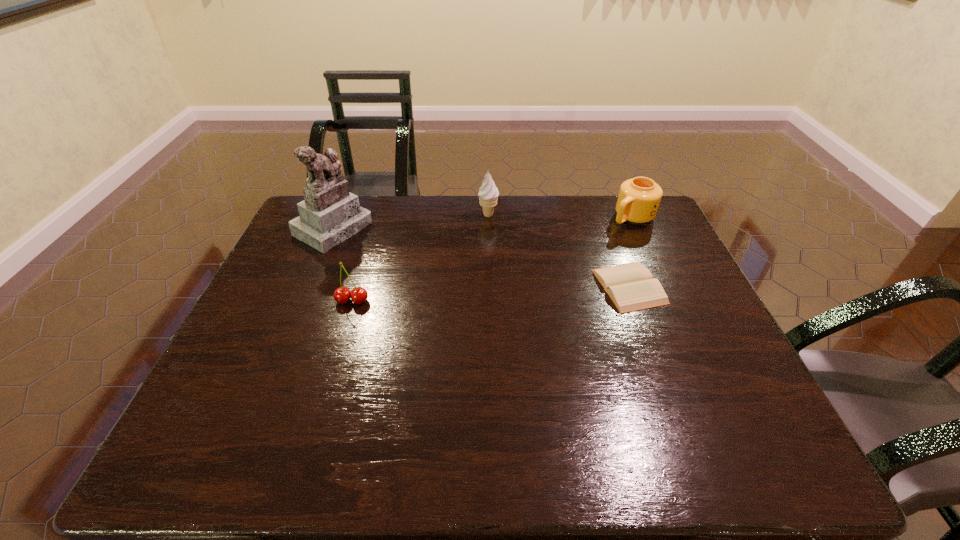
This screenshot has height=540, width=960. Find the location of `vacant space located 0.100m on the front-facing side of the figurine`. vacant space located 0.100m on the front-facing side of the figurine is located at coordinates (381, 255).

The image size is (960, 540). Identify the location of vacant space located on the front-facing side of the second tallest object. (480, 237).

Where is `vacant space located on the front-facing side of the second tallest object`? Image resolution: width=960 pixels, height=540 pixels. vacant space located on the front-facing side of the second tallest object is located at coordinates (466, 279).

I want to click on free region located on the front-facing side of the second tallest object, so click(475, 251).

I want to click on vacant space located on the handle side of the mug, so click(557, 273).

The width and height of the screenshot is (960, 540). Identify the location of vacant space located on the handle side of the mug. (585, 253).

Locate an element on the screen. This screenshot has height=540, width=960. vacant space located 0.390m on the handle side of the mug is located at coordinates (541, 285).

You are a GUI agent. You are given a task and a screenshot of the screen. Output one action in this format:
    pyautogui.click(x=<x>, y=<y>)
    Task: Click on the figurine that is at the far edge
    This screenshot has width=960, height=540.
    Given the screenshot: What is the action you would take?
    pyautogui.click(x=329, y=214)

At what (x,y) coordinates should I click in order to perform the action: click on icecream that is at the far edge. Please return your answer as a coordinate pair (x, y). The height and width of the screenshot is (540, 960). Looking at the image, I should click on (488, 194).

I want to click on mug that is at the far edge, so click(x=639, y=198).